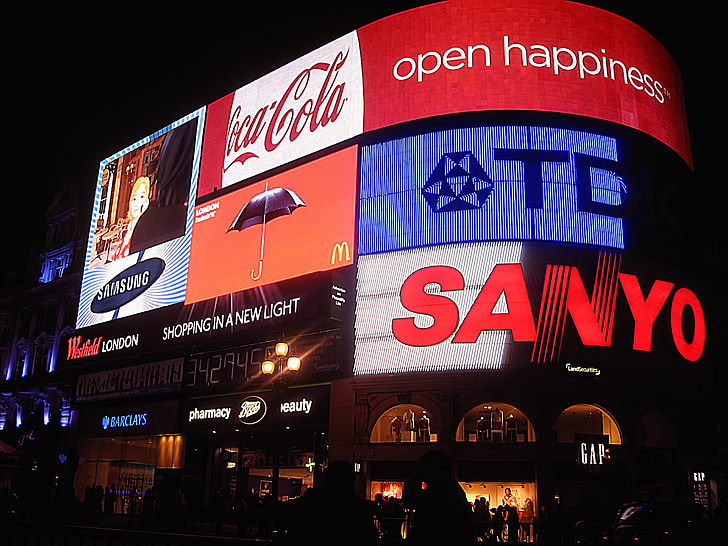
Locate an element on the screen. purple light is located at coordinates (57, 243), (47, 330), (49, 414).